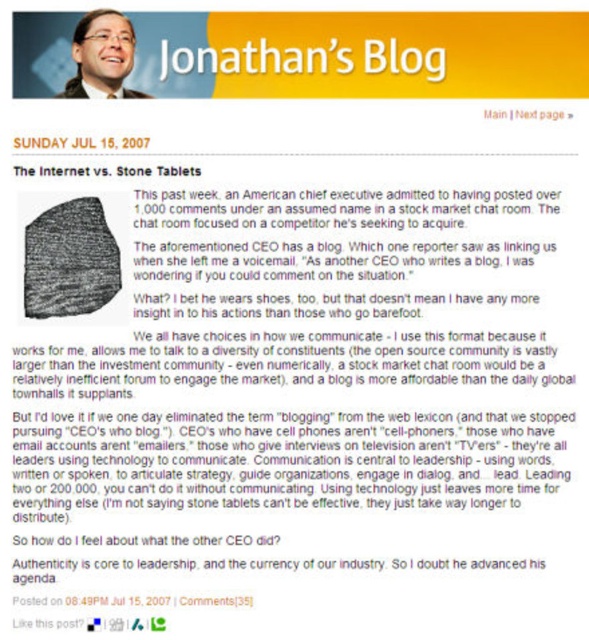
What is the 2D coordinate of the black stone tablet at upper left in the image?

The 2D coordinate of the black stone tablet at upper left is at point (58,170).

You are designing a layout for a blog header. You have the white paper at upper center and the matte black glasses at upper left. According to the image, which object is positioned to the right side of the other?

The white paper at upper center is positioned to the right of the matte black glasses at upper left.